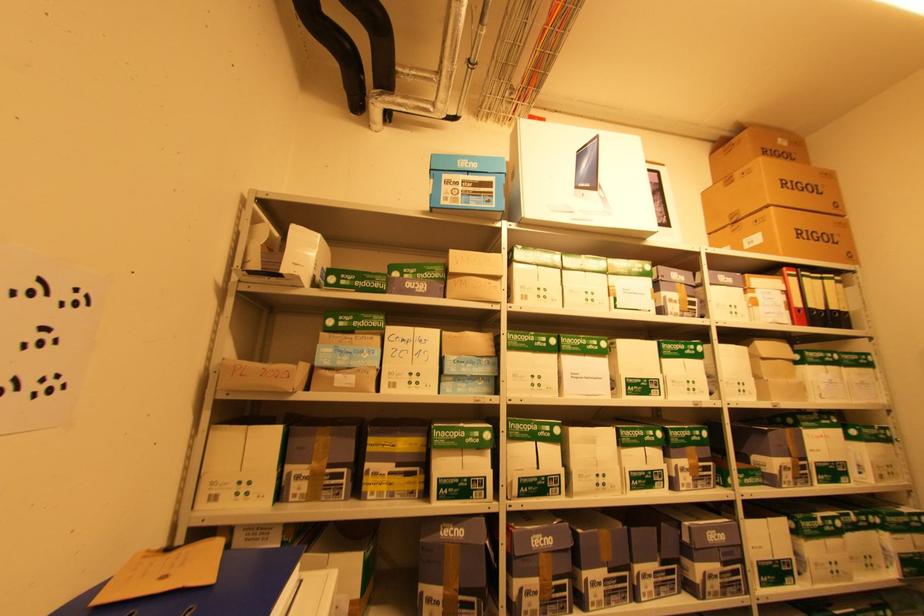
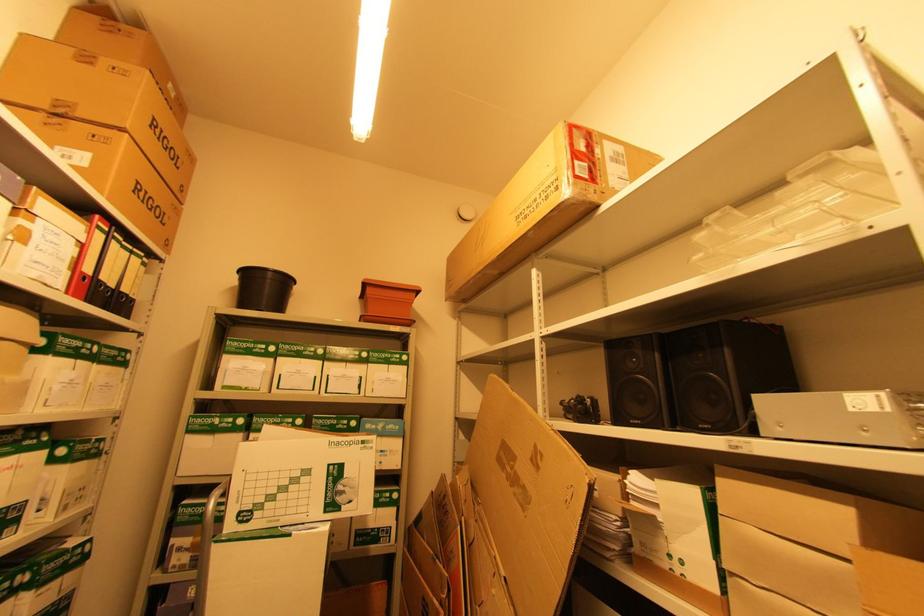
How did the camera likely rotate?

The camera rotated toward right-up.